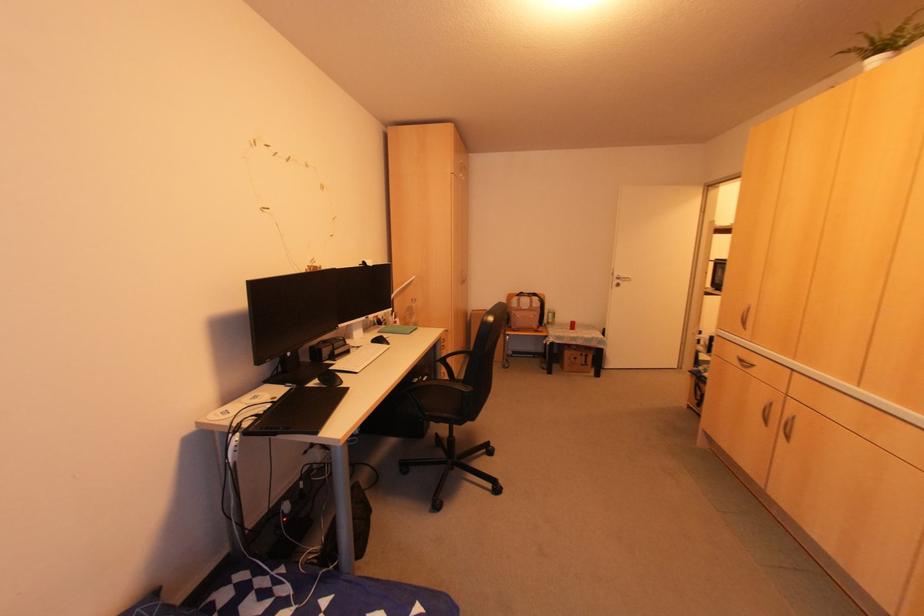
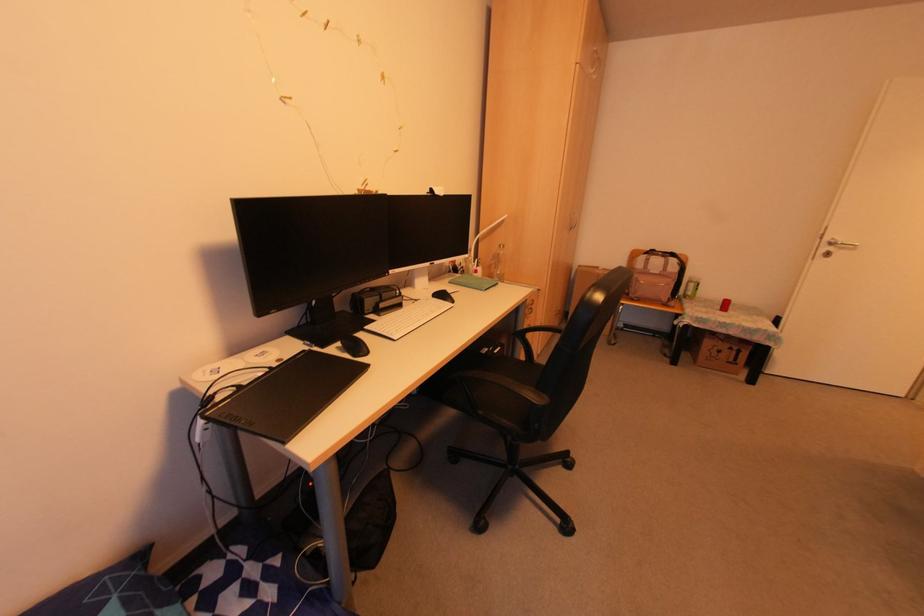
Find the pixel in the second image that matches (545,323) in the first image.

(683, 296)